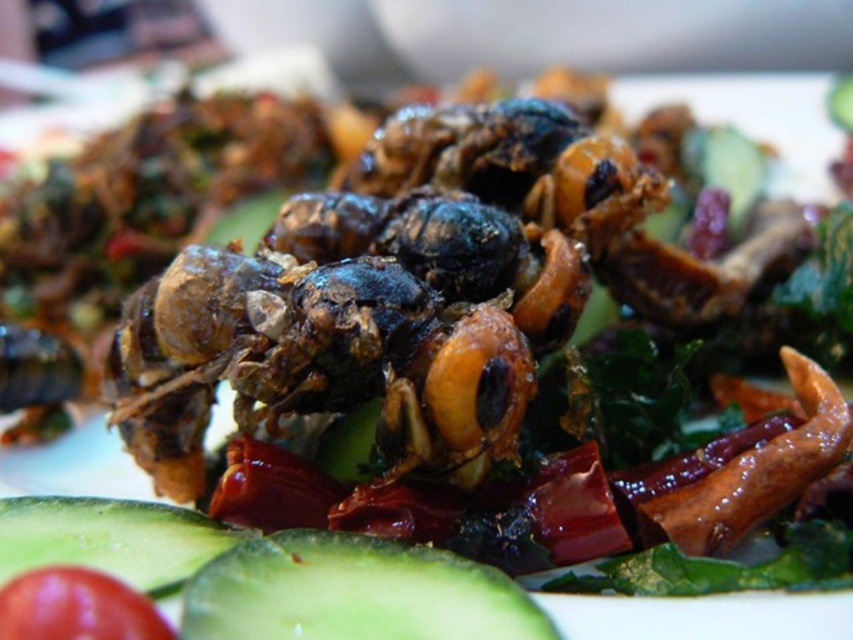
Question: In this image, where is green matte cucumber at lower left located relative to red matte tomato at lower left?

Choices:
 (A) above
 (B) below

Answer: (B)

Question: Which object appears farthest from the camera in this image?

Choices:
 (A) green smooth cucumber at lower left
 (B) green matte cucumber at lower left
 (C) red matte tomato at lower left

Answer: (B)

Question: Which object is farther from the camera taking this photo?

Choices:
 (A) green smooth cucumber at lower left
 (B) green matte cucumber at lower left

Answer: (B)

Question: Which point appears farthest from the camera in this image?

Choices:
 (A) (9, 499)
 (B) (412, 556)
 (C) (26, 602)

Answer: (A)

Question: Can you confirm if green matte cucumber at lower left is thinner than red matte tomato at lower left?

Choices:
 (A) yes
 (B) no

Answer: (B)

Question: Is green matte cucumber at lower left to the right of red matte tomato at lower left from the viewer's perspective?

Choices:
 (A) no
 (B) yes

Answer: (A)